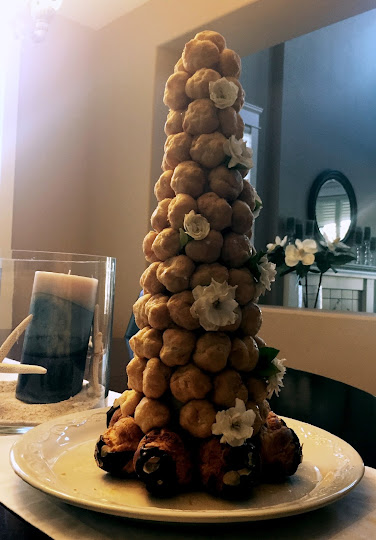
At what (x,y) coordinates should I click in order to perform the action: click on table. Please return your answer as a coordinate pair (x, y). The image size is (376, 540). Looking at the image, I should click on point(12,437), point(28,495), point(354,521).